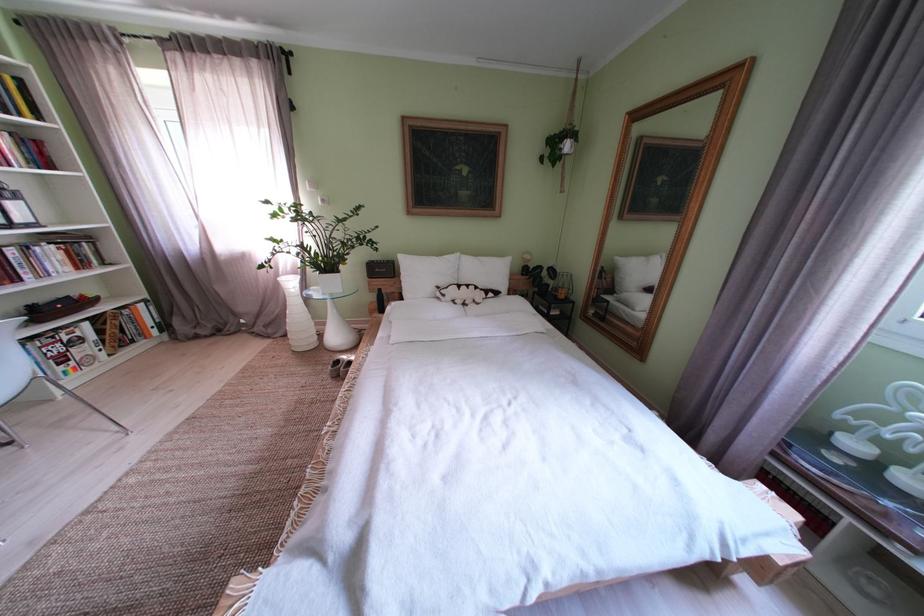
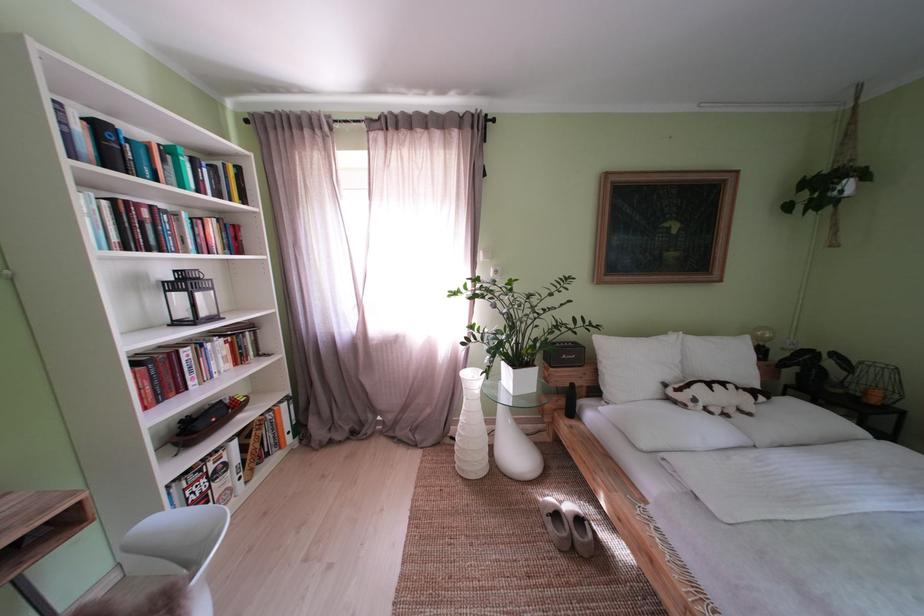
The point at (429, 280) is marked in the first image. Where is the corresponding point in the second image?

(639, 369)